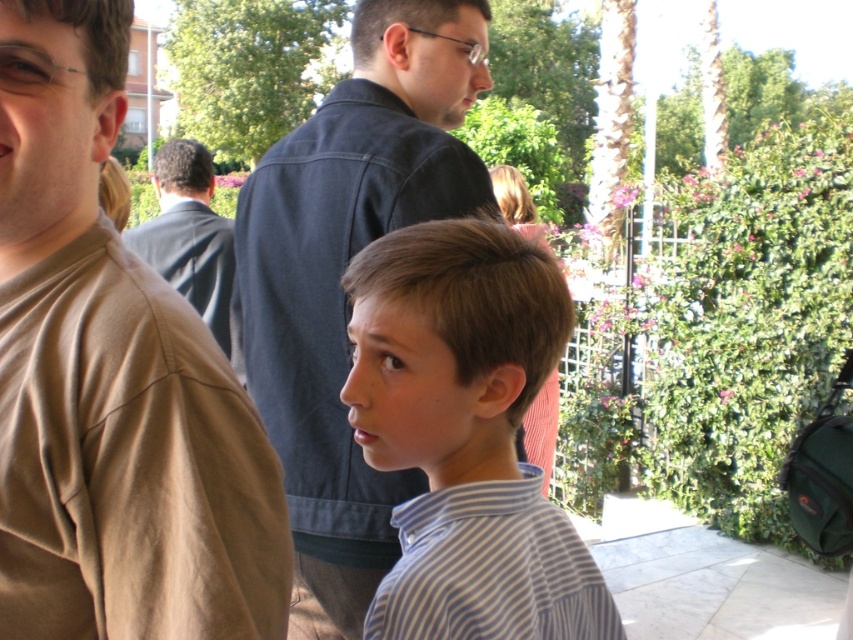
Question: From the image, what is the correct spatial relationship of brown cotton shirt at left in relation to white striped shirt at center?

Choices:
 (A) above
 (B) below

Answer: (A)

Question: Does striped cotton shirt at center appear over white striped shirt at center?

Choices:
 (A) yes
 (B) no

Answer: (A)

Question: Among these objects, which one is farthest from the camera?

Choices:
 (A) brown cotton shirt at left
 (B) dark blue shirt at center
 (C) striped cotton shirt at center

Answer: (B)

Question: Among these points, which one is nearest to the camera?

Choices:
 (A) (206, 280)
 (B) (384, 380)
 (C) (364, 163)

Answer: (B)

Question: Can you confirm if brown cotton shirt at left is bigger than dark blue shirt at center?

Choices:
 (A) no
 (B) yes

Answer: (A)

Question: Which object is the closest to the dark blue shirt at center?

Choices:
 (A) white striped shirt at center
 (B) dark blue denim shirt at center
 (C) striped cotton shirt at center
 (D) brown cotton shirt at left

Answer: (B)